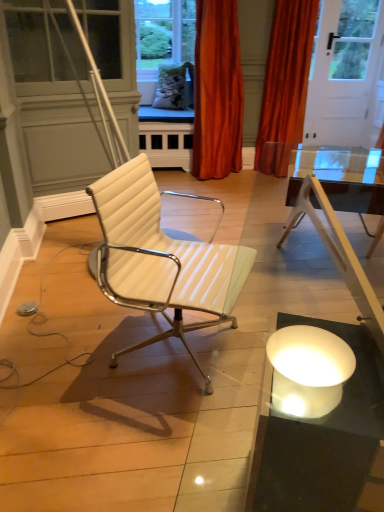
You are a GUI agent. You are given a task and a screenshot of the screen. Output one action in this format:
    pyautogui.click(x=<x>, y=<y>)
    Task: Click on the vacant area located to the right-hand side of orange velvet curtain at upper center, acting as the first curtain starting from the left
    The width and height of the screenshot is (384, 512).
    Given the screenshot: What is the action you would take?
    pyautogui.click(x=261, y=181)